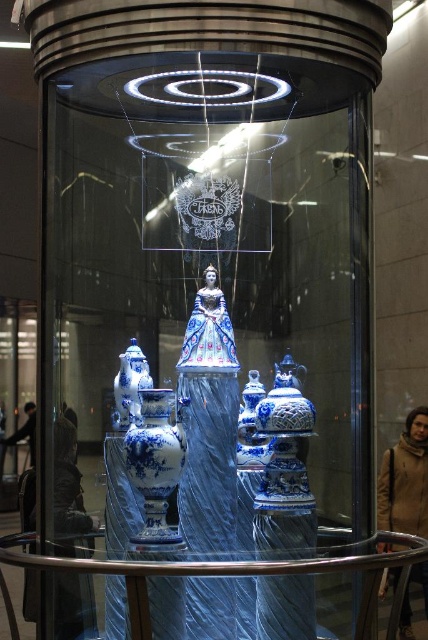
Question: Is transparent plastic table at center to the left of blue glazed porcelain vase at left from the viewer's perspective?

Choices:
 (A) no
 (B) yes

Answer: (A)

Question: Which point is farther from the camera taking this photo?

Choices:
 (A) (131, 456)
 (B) (2, 557)
 (C) (125, 422)

Answer: (C)

Question: Is transparent plastic table at center below blue porcelain vase at center?

Choices:
 (A) no
 (B) yes

Answer: (B)

Question: Which point is closer to the camera?

Choices:
 (A) 133,372
 (B) 154,438

Answer: (B)

Question: Which object is the farthest from the transparent plastic table at center?

Choices:
 (A) blue porcelain vase at center
 (B) blue glazed porcelain vase at left

Answer: (B)

Question: Considering the relative positions of transparent plastic table at center and blue glazed porcelain vase at left in the image provided, where is transparent plastic table at center located with respect to blue glazed porcelain vase at left?

Choices:
 (A) right
 (B) left

Answer: (A)